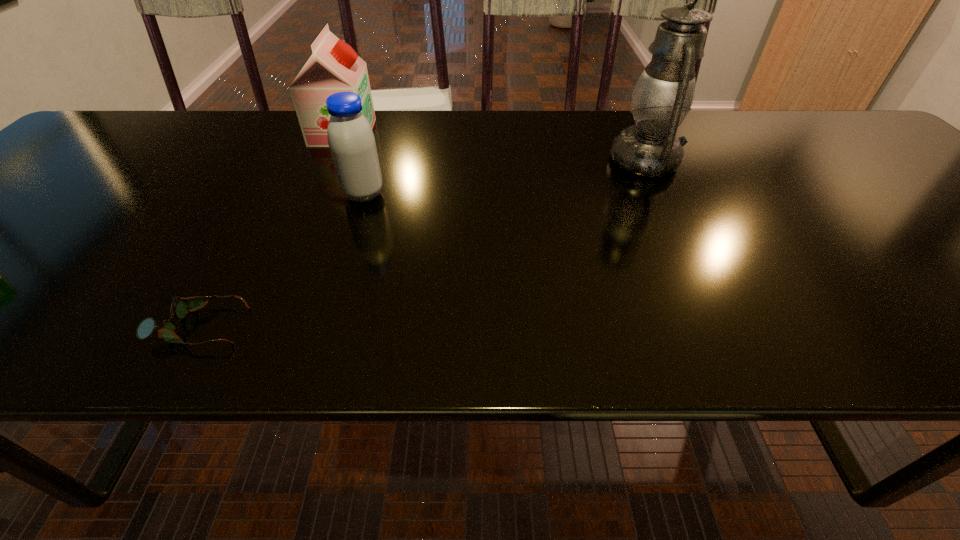
Locate an element on the screen. The height and width of the screenshot is (540, 960). oil lamp at the far edge is located at coordinates (663, 95).

Locate an element on the screen. soya milk that is at the far edge is located at coordinates (334, 66).

This screenshot has height=540, width=960. What are the coordinates of `object present at the near edge` in the screenshot? It's located at (180, 307).

You are a GUI agent. You are given a task and a screenshot of the screen. Output one action in this format:
    pyautogui.click(x=<x>, y=<y>)
    Task: Click on the vacant space at the far edge of the desktop
    
    Given the screenshot: What is the action you would take?
    pyautogui.click(x=423, y=141)

In the image, there is a desktop. Identify the location of vacant space at the near edge. The height and width of the screenshot is (540, 960). [252, 313].

Where is `vacant space at the left edge of the desktop`? The image size is (960, 540). vacant space at the left edge of the desktop is located at coordinates tap(27, 186).

Locate an element on the screen. The image size is (960, 540). vacant space at the right edge is located at coordinates (892, 197).

Where is `free space between the tallest object and the nearer soya milk`? The width and height of the screenshot is (960, 540). free space between the tallest object and the nearer soya milk is located at coordinates (504, 178).

Locate an element on the screen. vacant space that's between the nearer soya milk and the spectacles is located at coordinates (281, 260).

You are a GUI agent. You are given a task and a screenshot of the screen. Output one action in this format:
    pyautogui.click(x=<x>, y=<y>)
    Task: Click on the free spot between the nearer soya milk and the oil lamp
    Image resolution: width=960 pixels, height=540 pixels.
    Given the screenshot: What is the action you would take?
    pyautogui.click(x=504, y=178)